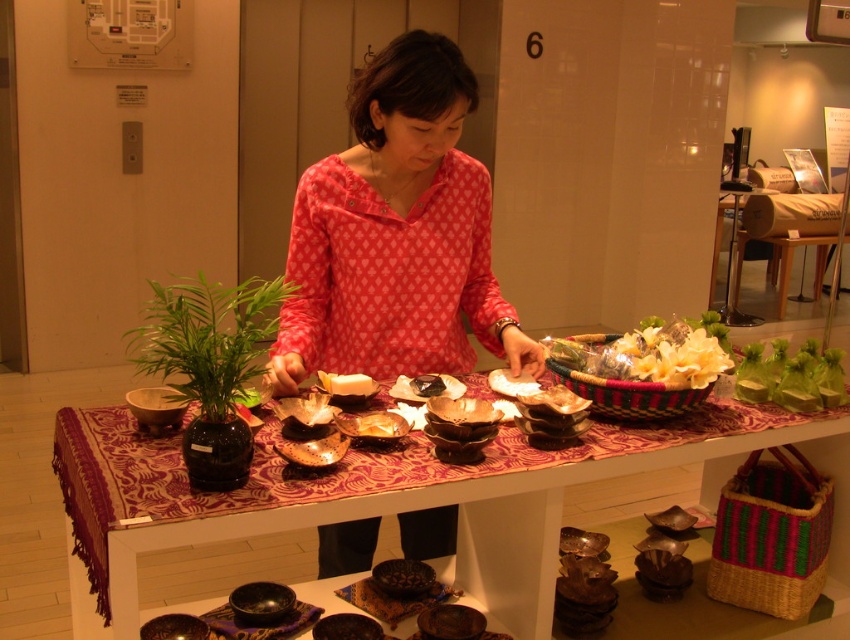
Question: Which of the following is the closest to the observer?

Choices:
 (A) (360, 381)
 (B) (536, 403)

Answer: (B)

Question: Which of the following is the farthest from the observer?

Choices:
 (A) (327, 380)
 (B) (476, 420)
 (C) (528, 406)
 (D) (836, 404)

Answer: (D)

Question: Can you confirm if green paper wrapped food at center is positioned to the left of brown matte bowl at center?

Choices:
 (A) no
 (B) yes

Answer: (A)

Question: Which point is farther from the camera taking this photo?

Choices:
 (A) (541, 403)
 (B) (370, 138)
 (C) (214, 518)

Answer: (B)

Question: Does pink printed blouse at center appear under white glossy bowl at center?

Choices:
 (A) no
 (B) yes

Answer: (A)

Question: Does floral-patterned fabric basket at center have a greater width compared to white glossy plate at center?

Choices:
 (A) yes
 (B) no

Answer: (A)